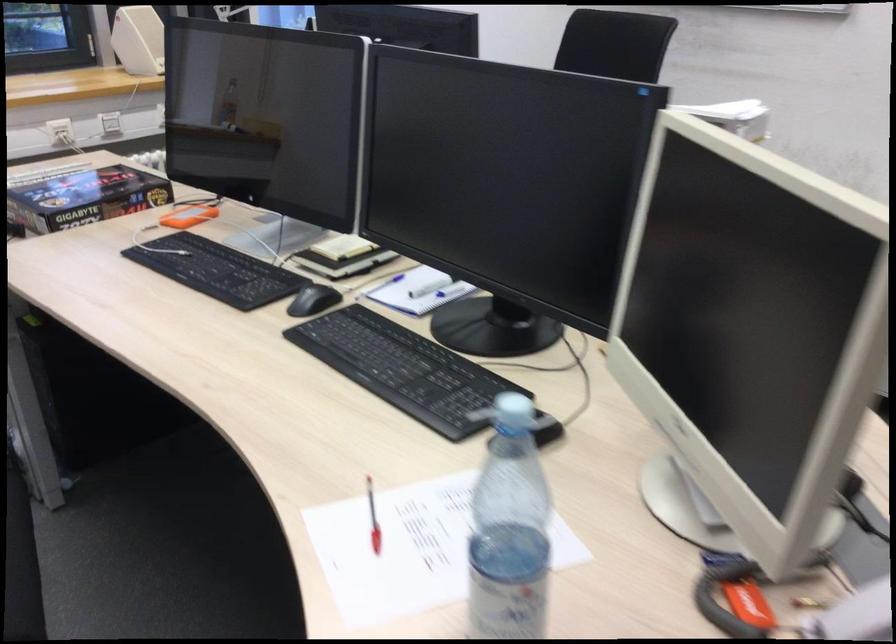
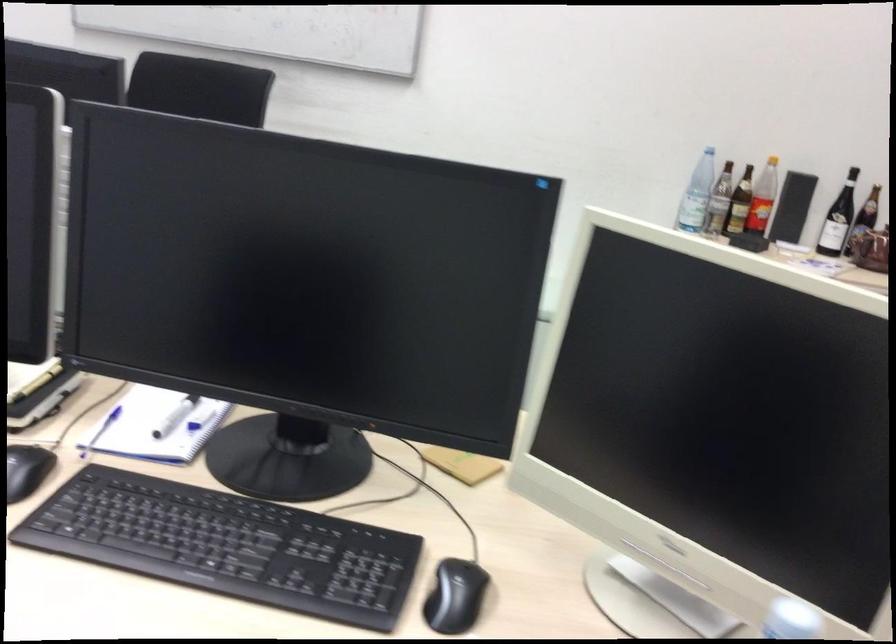
Question: The camera is either moving clockwise (left) or counter-clockwise (right) around the object. The first image is from the beginning of the video and the second image is from the end. Is the camera moving left or right when shooting the video?

Choices:
 (A) Left
 (B) Right

Answer: (A)